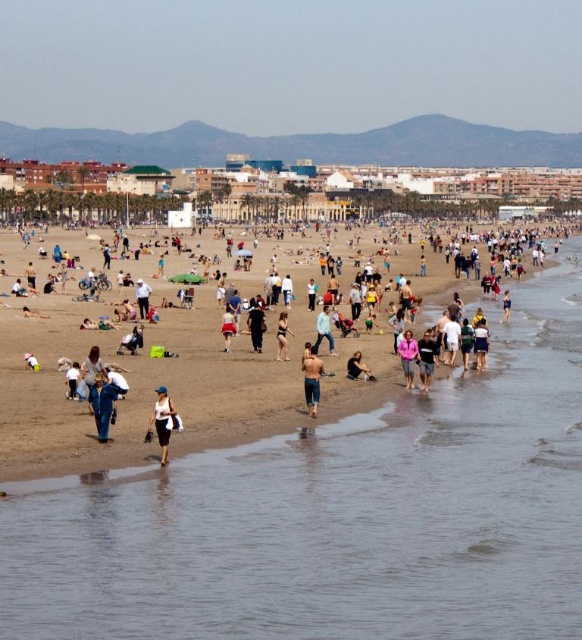
You are standing at the edge of the beach and want to reach the clear water at beach center. Which direction should you walk to get there?

The clear water at beach center is located at point 0.806 on the x and 0.582 on the y coordinate, so you should walk towards the center of the beach to reach it.

Based on the photo, what are the coordinates of the pink fabric jacket at lower center in the image?

The pink fabric jacket at lower center is located at coordinates (407, 356).

You are a photographer standing at the center of the beach scene. You want to capture a photo of the white matte dress at lower center. Based on its position coordinates, where should you aim your camera?

The white matte dress at lower center is located at coordinates point [162,422], so you should aim your camera towards the lower center area of the scene to capture it.